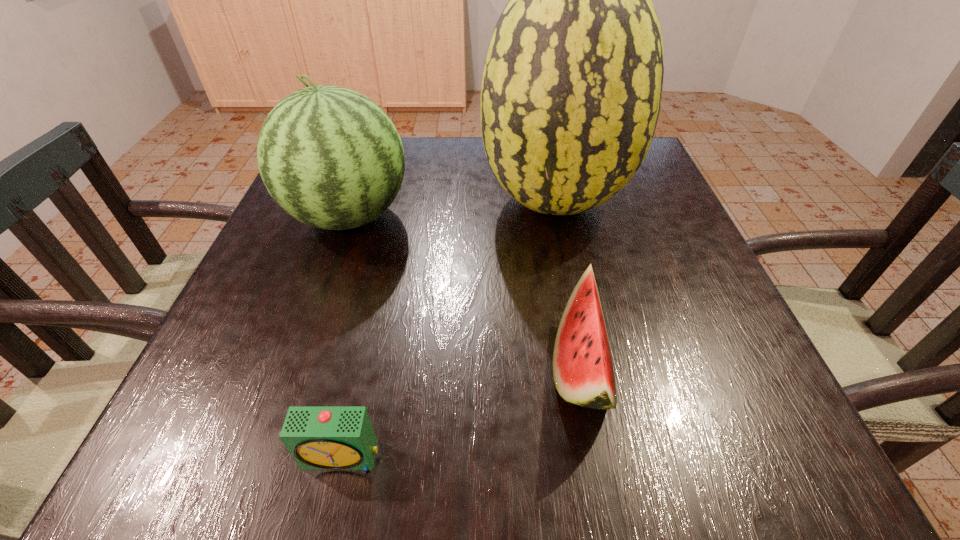
Locate an element on the screen. The width and height of the screenshot is (960, 540). the tallest object is located at coordinates click(571, 91).

Find the location of a particular element. This screenshot has width=960, height=540. the leftmost watermelon is located at coordinates (330, 157).

Find the location of a particular element. the second tallest watermelon is located at coordinates (330, 157).

At what (x,y) coordinates should I click in order to perform the action: click on the nearest watermelon. Please return your answer as a coordinate pair (x, y). Looking at the image, I should click on (583, 373).

Find the location of a particular element. The image size is (960, 540). the second shortest object is located at coordinates (583, 373).

You are a GUI agent. You are given a task and a screenshot of the screen. Output one action in this format:
    pyautogui.click(x=<x>, y=<y>)
    Task: Click on the alarm clock
    The height and width of the screenshot is (540, 960).
    Given the screenshot: What is the action you would take?
    pyautogui.click(x=318, y=437)

At what (x,y) coordinates should I click in order to perform the action: click on vacant space located on the front of the tallest watermelon. Please return your answer as a coordinate pair (x, y). The height and width of the screenshot is (540, 960). Looking at the image, I should click on (590, 376).

Locate an element on the screen. vacant space located 0.190m on the right of the leftmost watermelon is located at coordinates (497, 217).

Where is `free space located on the outer rind of the shortest watermelon`? free space located on the outer rind of the shortest watermelon is located at coordinates (367, 367).

The image size is (960, 540). Find the location of `vacant space located on the outer rind of the shortest watermelon`. vacant space located on the outer rind of the shortest watermelon is located at coordinates (342, 367).